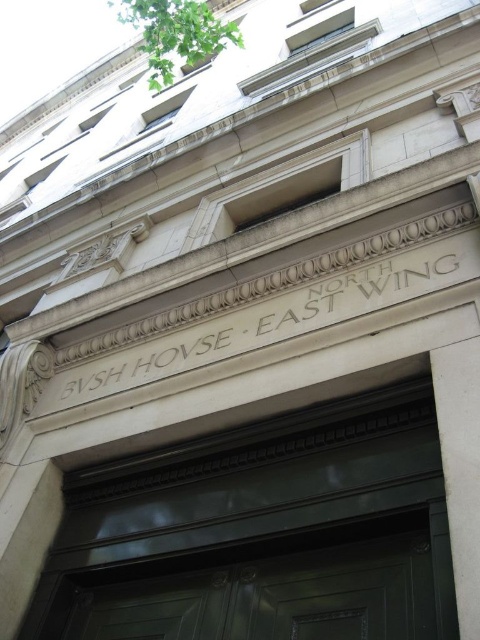
You are a delivery person trying to move a large box through the green polished wood door at center. The box is 3 feet wide. Can you fit it through the door if the white marble pillar at center is 2 feet wide?

The green polished wood door at center might be wider than the white marble pillar at center, which is 2 feet wide. Since the door could be wider, the 3 feet wide box might fit, but there is uncertainty due to the possible width difference.

You are a contractor measuring the dimensions of the building facade. You need to install a new sign that must be taller than both the green polished wood door at center and the white marble pillar at center. Based on the provided information, what is the minimum height the sign should be?

The green polished wood door at center is taller than the white marble pillar at center. Therefore, the sign must be taller than the green polished wood door at center to meet the requirement.